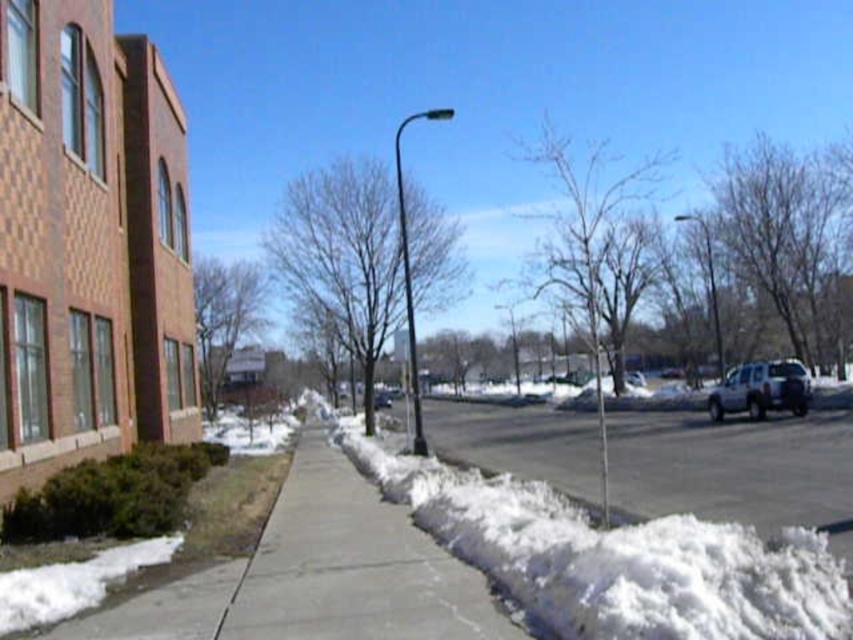
Question: Can you confirm if white fluffy snow at lower right is positioned to the right of white matte truck at right?

Choices:
 (A) yes
 (B) no

Answer: (B)

Question: Which object appears farthest from the camera in this image?

Choices:
 (A) white matte truck at right
 (B) white fluffy snow at lower right

Answer: (A)

Question: Does white fluffy snow at lower right have a larger size compared to white matte truck at right?

Choices:
 (A) yes
 (B) no

Answer: (B)

Question: Where is white fluffy snow at lower right located in relation to white matte truck at right in the image?

Choices:
 (A) above
 (B) below

Answer: (B)

Question: Which of the following is the closest to the observer?

Choices:
 (A) (743, 595)
 (B) (758, 404)

Answer: (A)